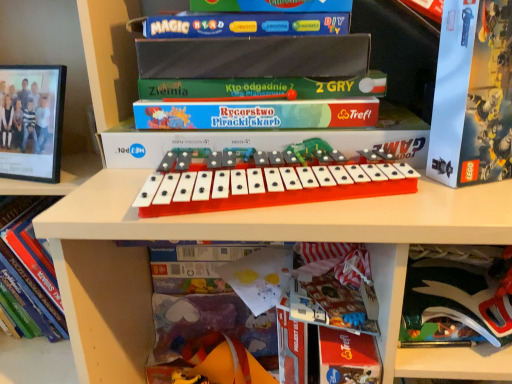
Find the location of `free location in front of white cardboard lego box at right, acting as the 1th paperback book starting from the top`. free location in front of white cardboard lego box at right, acting as the 1th paperback book starting from the top is located at coordinates (475, 198).